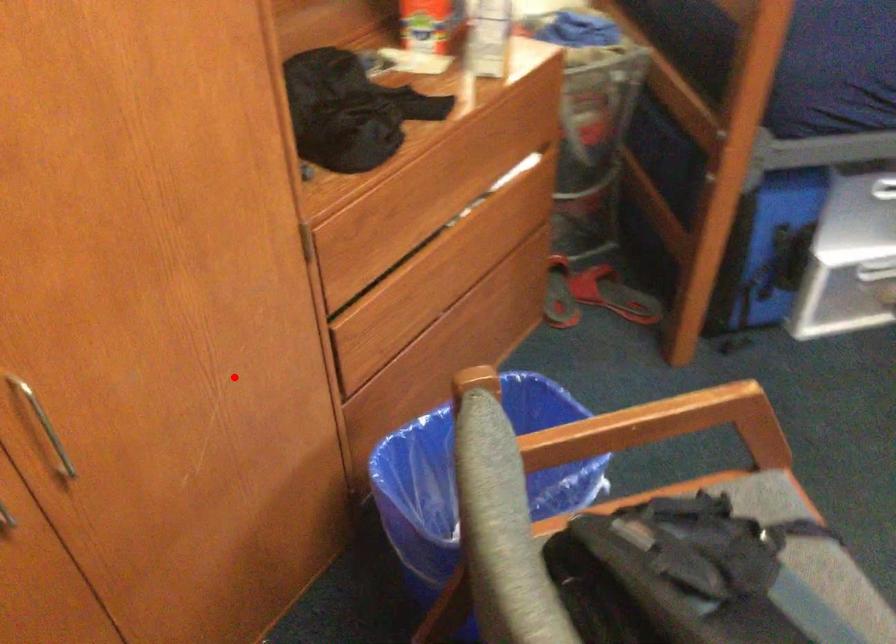
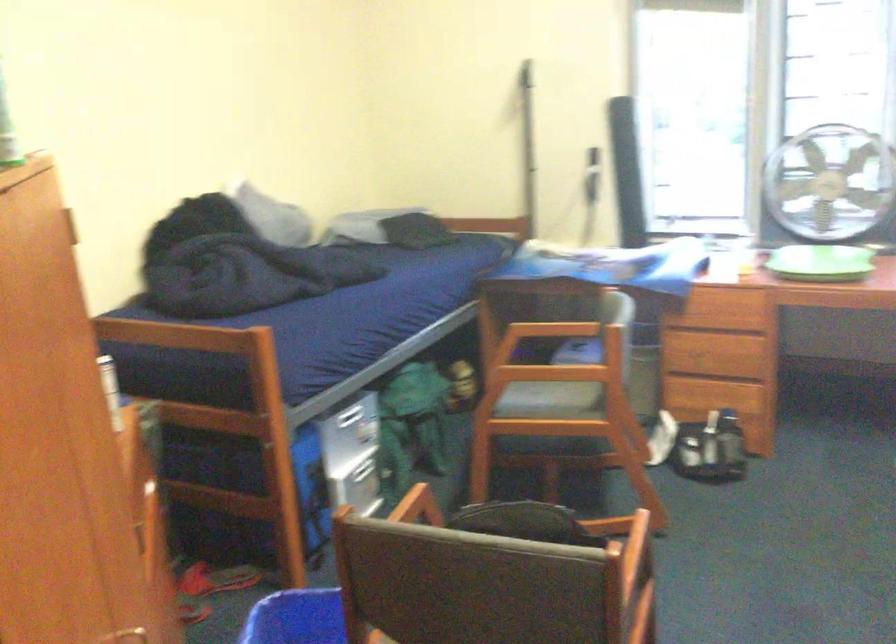
In the second image, find the point that corresponds to the highlighted location in the first image.

(141, 630)